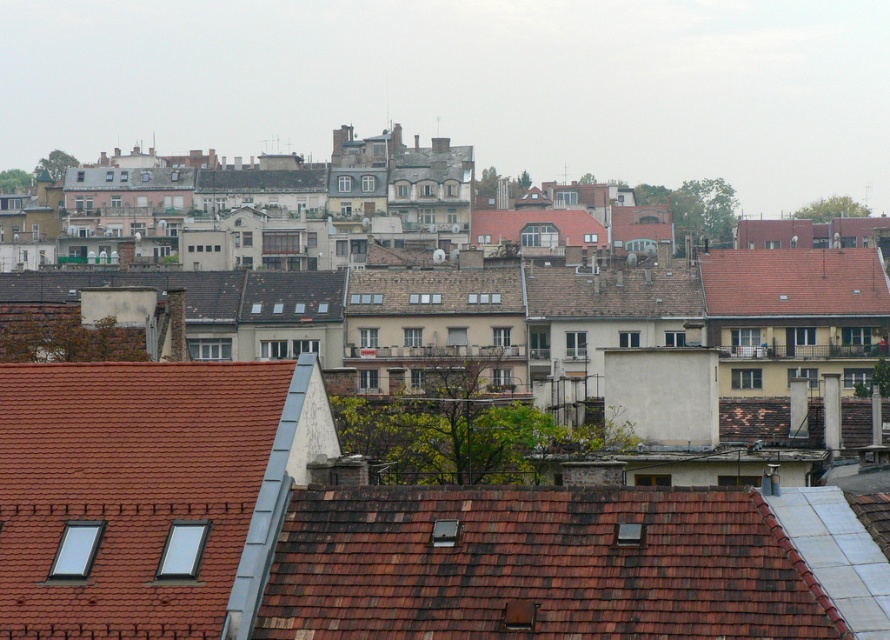
You are a drone operator who needs to land a drone on a specific location. The drone is currently above the brown shingles at center. The landing coordinates are at point (538, 564). Is the landing point on the brown shingles at center?

Yes, the point (538, 564) is on the brown shingles at center, so the drone can land there safely.

You are an architect analyzing the roof materials in this urban scene. Which of the two objects, the brown shingles at center or the red tile roof at upper right, would you estimate to have a larger surface area based on their visibility in the image?

The red tile roof at upper right has a larger surface area than the brown shingles at center since it appears bigger in the image.